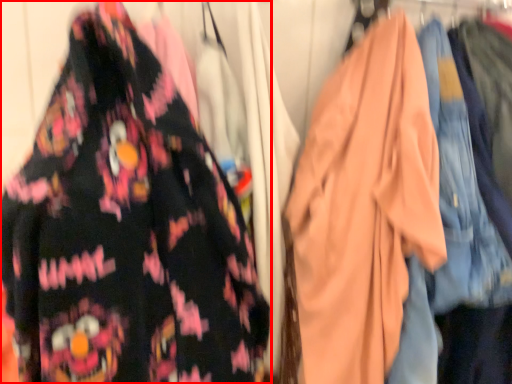
Question: Where is fancy dress (annotated by the red box) located in relation to garment in the image?

Choices:
 (A) right
 (B) left

Answer: (B)